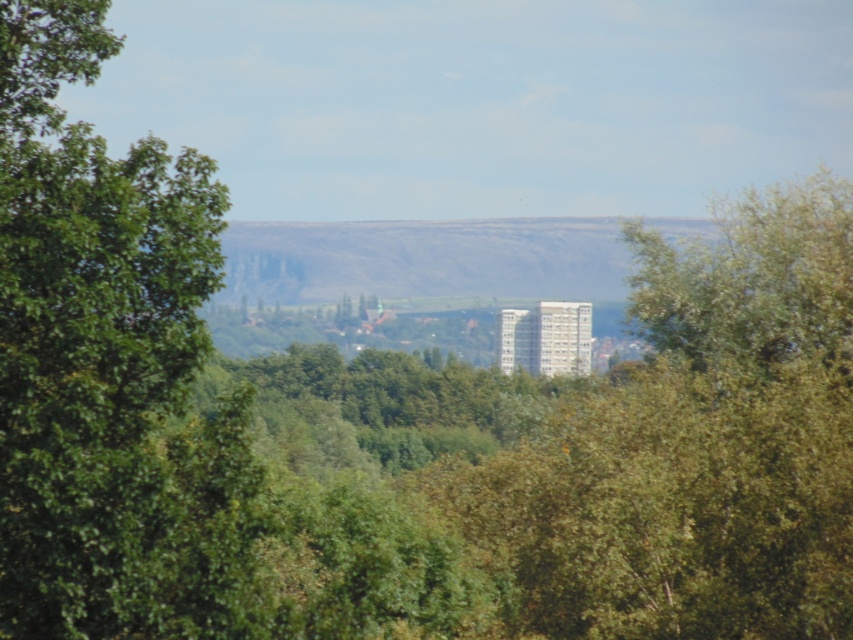
You are standing at the center of the image and want to walk towards the green leafy tree at left. Which direction should you face to head directly towards it?

The green leafy tree at left is located at point coordinates that are to the left of the center, so you should face to the left to head directly towards it.

You are a hiker planning to take a photo of the rocky cliff at center. You notice a green leafy tree at left in your viewfinder. Based on the scene, will the tree block your view of the cliff?

The green leafy tree at left is closer to the viewer than the rocky cliff at center, so it will block the view of the rocky cliff at center unless you move to a position where the tree is out of the way.

You are standing at the point marked by the coordinate point at point (109, 369). Looking around, you see a green leafy tree at left. Which direction should you face to look towards the green leafy tree at left?

The green leafy tree at left is located to your left side, so you should turn your body to face the left direction to look towards the green leafy tree at left.